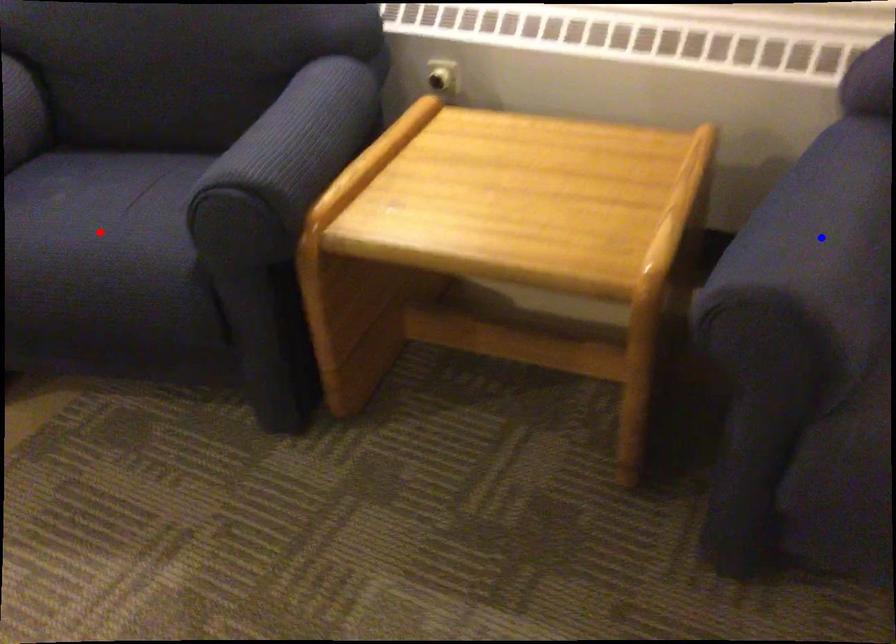
Question: Two points are marked on the image. Which point is closer to the camera?

Choices:
 (A) Blue point is closer.
 (B) Red point is closer.

Answer: (A)